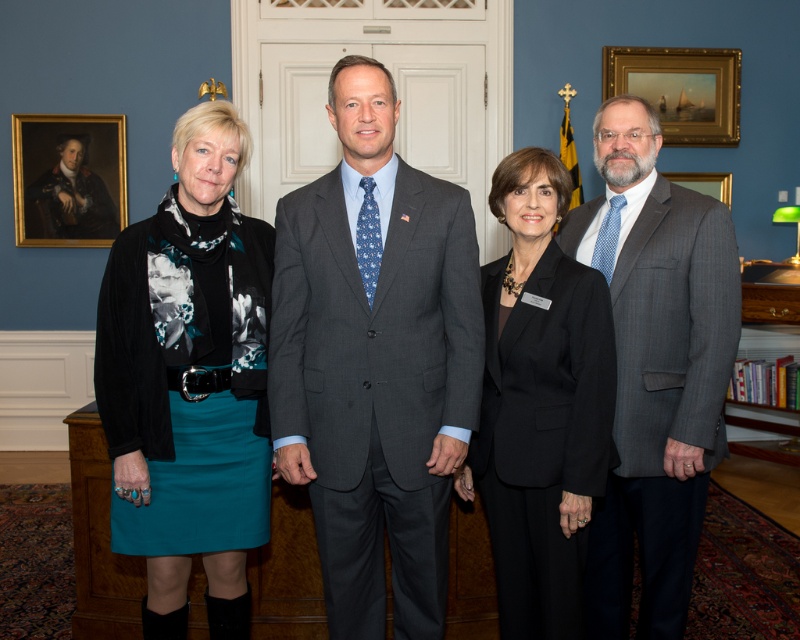
Is black matte suit at center below wooden portrait frame at upper left?

Indeed, black matte suit at center is positioned under wooden portrait frame at upper left.

Can you confirm if black matte suit at center is positioned to the left of wooden portrait frame at upper left?

No, black matte suit at center is not to the left of wooden portrait frame at upper left.

Does point (541, 378) lie behind point (66, 244)?

No, it is not.

This screenshot has height=640, width=800. What are the coordinates of `black matte suit at center` in the screenshot? It's located at (540, 403).

Is gray suit at center below wooden portrait frame at upper left?

Correct, gray suit at center is located below wooden portrait frame at upper left.

Can you confirm if gray suit at center is smaller than wooden portrait frame at upper left?

Incorrect, gray suit at center is not smaller in size than wooden portrait frame at upper left.

Is point (354, 403) more distant than point (76, 209)?

No, it is in front of (76, 209).

In order to click on gray suit at center in this screenshot , I will do `click(376, 362)`.

Can you confirm if gray suit at center is shorter than wooden picture frame at right?

No.

Between gray suit at center and wooden picture frame at right, which one is positioned lower?

gray suit at center is below.

Is point (425, 336) positioned behind point (718, 180)?

No, it is not.

Image resolution: width=800 pixels, height=640 pixels. I want to click on gray suit at center, so click(376, 362).